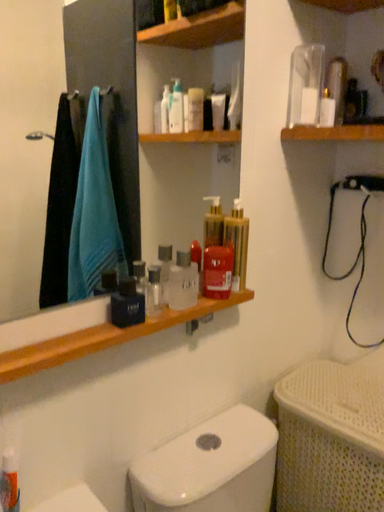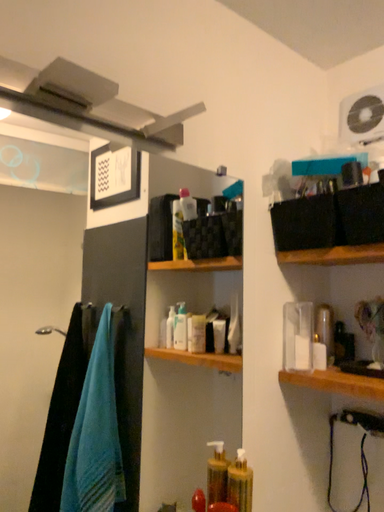
Question: Which way did the camera rotate in the video?

Choices:
 (A) rotated upward
 (B) rotated downward

Answer: (A)